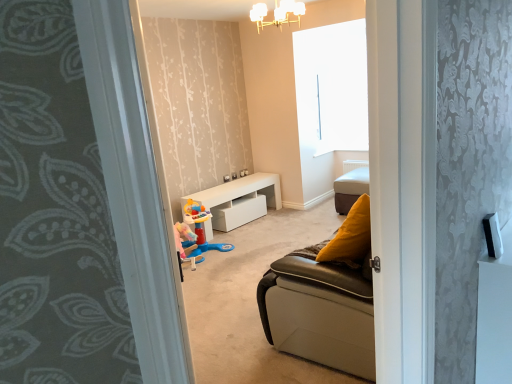
Where is `gray floral carpet at left`? The height and width of the screenshot is (384, 512). gray floral carpet at left is located at coordinates (55, 213).

Where is `white glossy table at center`? white glossy table at center is located at coordinates (238, 201).

Describe the element at coordinates (199, 230) in the screenshot. I see `pastel pink plastic toy at center` at that location.

Locate an element on the screen. This screenshot has height=384, width=512. pastel pink plastic toy at center is located at coordinates (199, 230).

In order to click on gray floral carpet at left in this screenshot , I will do `click(55, 213)`.

Considering the sizes of white glossy table at center and white frosted glass chandelier at upper center in the image, is white glossy table at center taller or shorter than white frosted glass chandelier at upper center?

Clearly, white glossy table at center is taller compared to white frosted glass chandelier at upper center.

From a real-world perspective, is white glossy table at center physically located above or below white frosted glass chandelier at upper center?

From a real-world perspective, white glossy table at center is physically below white frosted glass chandelier at upper center.

Which object is further away from the camera, white glossy table at center or white frosted glass chandelier at upper center?

Positioned behind is white glossy table at center.

You are a GUI agent. You are given a task and a screenshot of the screen. Output one action in this format:
    pyautogui.click(x=<x>, y=<y>)
    Task: Click on the light fixture that appears above the white glossy table at center (from the image's perspective)
    
    Given the screenshot: What is the action you would take?
    pyautogui.click(x=277, y=13)

Consider the image. Is pastel pink plastic toy at center aimed at leather cushion at center?

No, pastel pink plastic toy at center is not aimed at leather cushion at center.

Find the location of a particular element. Image resolution: width=512 pixels, height=384 pixels. furniture that appears on the right of pastel pink plastic toy at center is located at coordinates click(350, 189).

Who is bigger, pastel pink plastic toy at center or leather cushion at center?

pastel pink plastic toy at center.

Measure the distance between pastel pink plastic toy at center and leather cushion at center.

pastel pink plastic toy at center and leather cushion at center are 5.20 feet apart.

Does gray floral carpet at left touch white glossy table at center?

gray floral carpet at left and white glossy table at center are not in contact.

From a real-world perspective, which object rests below the other?

white glossy table at center, from a real-world perspective.

Is point (347, 176) positioned before point (221, 222)?

No.

How different are the orientations of leather cushion at center and white glossy table at center in degrees?

The angular difference between leather cushion at center and white glossy table at center is 89 degrees.

This screenshot has width=512, height=384. In the image, there is a leather cushion at center. In order to click on table below it (from the image's perspective) in this screenshot , I will do click(x=238, y=201).

From a real-world perspective, which object rests below the other?

white glossy table at center is physically lower.

From the image's perspective, is gray floral carpet at left above or below pastel pink plastic toy at center?

Based on their image positions, gray floral carpet at left is located above pastel pink plastic toy at center.

Which is in front, gray floral carpet at left or pastel pink plastic toy at center?

gray floral carpet at left.

Which object is positioned more to the right, gray floral carpet at left or pastel pink plastic toy at center?

gray floral carpet at left is more to the right.

Which object is positioned more to the left, leather cushion at center or gray floral carpet at left?

gray floral carpet at left is more to the left.

Considering the relative positions of leather cushion at center and gray floral carpet at left in the image provided, is leather cushion at center in front of gray floral carpet at left?

No, leather cushion at center is further to the viewer.

Could you tell me if leather cushion at center is turned towards gray floral carpet at left?

Yes, leather cushion at center is oriented towards gray floral carpet at left.

Which is more to the left, white frosted glass chandelier at upper center or leather cushion at center?

white frosted glass chandelier at upper center is more to the left.

Measure the distance between white frosted glass chandelier at upper center and leather cushion at center.

A distance of 1.88 meters exists between white frosted glass chandelier at upper center and leather cushion at center.

Is white frosted glass chandelier at upper center far away from leather cushion at center?

white frosted glass chandelier at upper center is far away from leather cushion at center.

Is white frosted glass chandelier at upper center oriented towards leather cushion at center?

No.

I want to click on light fixture in front of the white glossy table at center, so click(277, 13).

Find the location of a particular element. This screenshot has width=512, height=384. toy on the left side of leather cushion at center is located at coordinates (199, 230).

Looking at the image, which one is located further to white frosted glass chandelier at upper center, leather cushion at center or white glossy table at center?

Based on the image, white glossy table at center appears to be further to white frosted glass chandelier at upper center.

Considering their positions, is leather cushion at center positioned further to white glossy table at center than white frosted glass chandelier at upper center?

white frosted glass chandelier at upper center is positioned further to the anchor white glossy table at center.

When comparing their distances from pastel pink plastic toy at center, does white glossy table at center or white frosted glass chandelier at upper center seem closer?

white glossy table at center is closer to pastel pink plastic toy at center.

When comparing their distances from leather cushion at center, does pastel pink plastic toy at center or gray floral carpet at left seem further?

Among the two, gray floral carpet at left is located further to leather cushion at center.

Which object lies further to the anchor point white glossy table at center, white frosted glass chandelier at upper center or leather cushion at center?

Based on the image, white frosted glass chandelier at upper center appears to be further to white glossy table at center.

Considering their positions, is pastel pink plastic toy at center positioned closer to white glossy table at center than leather cushion at center?

Among the two, pastel pink plastic toy at center is located nearer to white glossy table at center.

Looking at the image, which one is located further to white frosted glass chandelier at upper center, leather cushion at center or gray floral carpet at left?

gray floral carpet at left is further to white frosted glass chandelier at upper center.

Estimate the real-world distances between objects in this image. Which object is further from leather cushion at center, gray floral carpet at left or pastel pink plastic toy at center?

Among the two, gray floral carpet at left is located further to leather cushion at center.

You are a GUI agent. You are given a task and a screenshot of the screen. Output one action in this format:
    pyautogui.click(x=<x>, y=<y>)
    Task: Click on the light fixture between gray floral carpet at left and white glossy table at center along the z-axis
    The image size is (512, 384).
    Given the screenshot: What is the action you would take?
    pyautogui.click(x=277, y=13)

You are a GUI agent. You are given a task and a screenshot of the screen. Output one action in this format:
    pyautogui.click(x=<x>, y=<y>)
    Task: Click on the toy located between gray floral carpet at left and white glossy table at center in the depth direction
    The width and height of the screenshot is (512, 384).
    Given the screenshot: What is the action you would take?
    pyautogui.click(x=199, y=230)

The width and height of the screenshot is (512, 384). Identify the location of table between white frosted glass chandelier at upper center and pastel pink plastic toy at center in the up-down direction. (238, 201).

Locate an element on the screen. The height and width of the screenshot is (384, 512). toy between gray floral carpet at left and leather cushion at center along the z-axis is located at coordinates (199, 230).